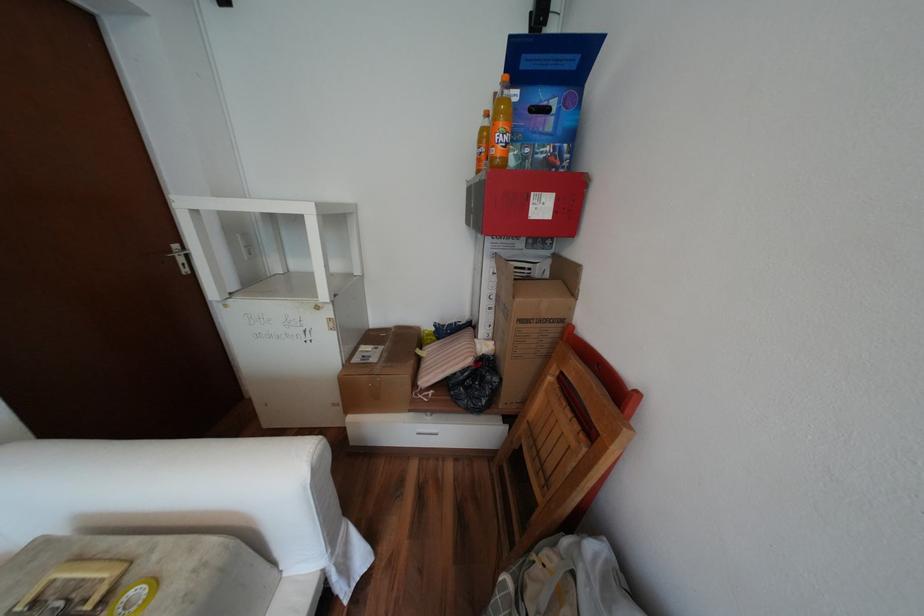
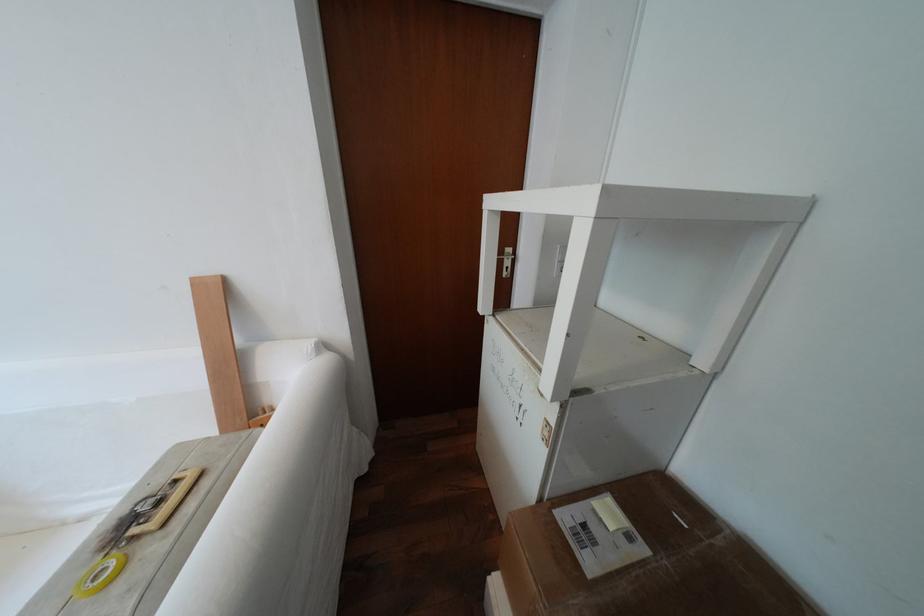
Question: The camera is either moving clockwise (left) or counter-clockwise (right) around the object. The first image is from the beginning of the video and the second image is from the end. Is the camera moving left or right when shooting the video?

Choices:
 (A) Left
 (B) Right

Answer: (B)